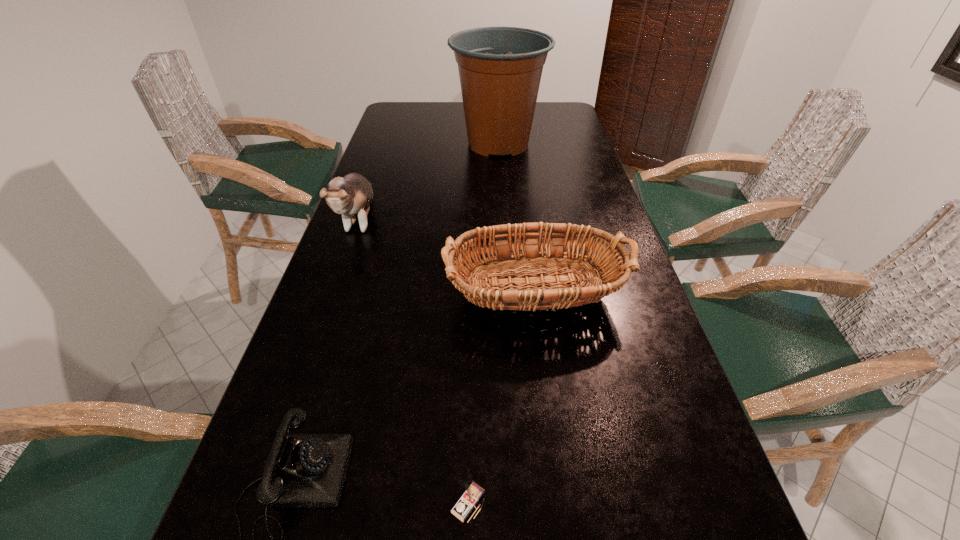
Find the location of a particular element. The width and height of the screenshot is (960, 540). unoccupied area between the cat and the farthest object is located at coordinates (429, 181).

You are a GUI agent. You are given a task and a screenshot of the screen. Output one action in this format:
    pyautogui.click(x=<x>, y=<y>)
    Task: Click on the unoccupied position between the basket and the matchbox
    The image size is (960, 540).
    Given the screenshot: What is the action you would take?
    pyautogui.click(x=500, y=398)

Find the location of a particular element. Image resolution: width=960 pixels, height=540 pixels. object that is the fourth closest one to the basket is located at coordinates (500, 68).

Image resolution: width=960 pixels, height=540 pixels. I want to click on object that stands as the second closest to the flowerpot, so click(x=608, y=270).

Identify the location of vacant region that satisfies the following two spatial constraints: 1. at the face of the cat; 2. on the right side of the matchbox. The height and width of the screenshot is (540, 960). (259, 503).

This screenshot has width=960, height=540. Find the location of `free location that satisfies the following two spatial constraints: 1. on the front side of the farthest object; 2. on the left side of the basket`. free location that satisfies the following two spatial constraints: 1. on the front side of the farthest object; 2. on the left side of the basket is located at coordinates click(x=509, y=294).

The image size is (960, 540). In order to click on vacant space that satisfies the following two spatial constraints: 1. at the face of the cat; 2. on the right side of the matchbox in this screenshot , I will do `click(259, 503)`.